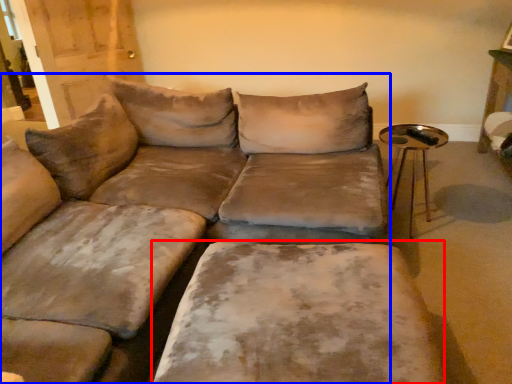
Question: Which point is closer to the camera, wide (highlighted by a red box) or studio couch (highlighted by a blue box)?

Choices:
 (A) wide
 (B) studio couch

Answer: (B)